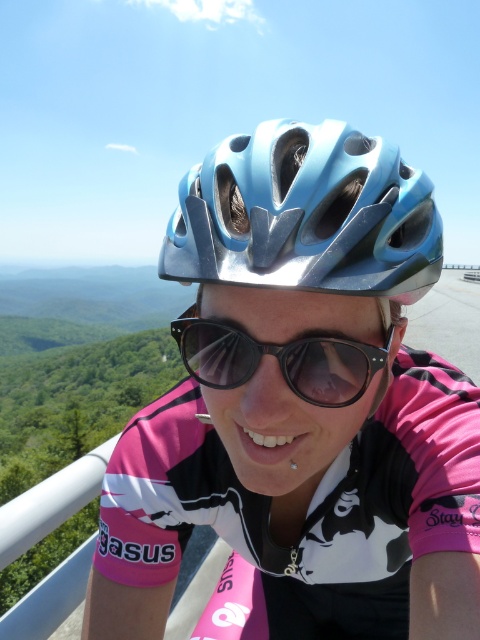
From the picture: You are a photographer trying to capture the cyclist from the front. The blue glossy bicycle helmet at center and the black matte sunglasses at center are both in your view. Which object will appear larger in your photo?

The blue glossy bicycle helmet at center will appear larger in the photo because it is closer to the viewer than the black matte sunglasses at center.

You are a photographer capturing the cyclist from the front. Two points on the cyclist are marked as point 1 at coordinates point (273, 177) and point 2 at coordinates point (192, 342). Which point should you focus on to ensure it appears larger in your photo?

Point 1 at coordinates point (273, 177) should be focused on because it is closer to the camera and will appear larger in the photo compared to point 2 at coordinates point (192, 342).

In the scene shown: You are a cyclist who wants to check if your blue glossy bicycle helmet at center is exactly at the point with coordinates (305, 216). Can you confirm this?

Yes, the blue glossy bicycle helmet at center is located exactly at point (305, 216).